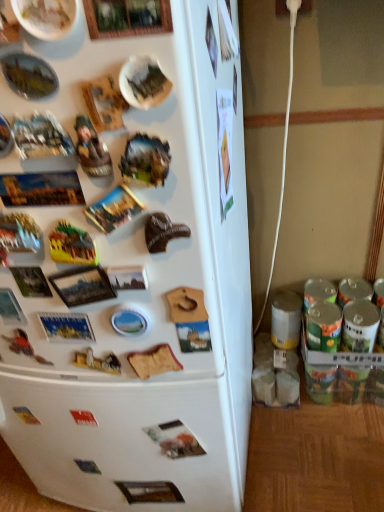
Question: Is white matte refrigerator at left not within wooden figurine at upper left?

Choices:
 (A) no
 (B) yes

Answer: (B)

Question: Is white matte refrigerator at left behind wooden figurine at upper left?

Choices:
 (A) yes
 (B) no

Answer: (B)

Question: Is wooden figurine at upper left located within white matte refrigerator at left?

Choices:
 (A) yes
 (B) no

Answer: (A)

Question: Considering the relative positions of white matte refrigerator at left and wooden figurine at upper left in the image provided, is white matte refrigerator at left to the right of wooden figurine at upper left from the viewer's perspective?

Choices:
 (A) yes
 (B) no

Answer: (B)

Question: From a real-world perspective, is white matte refrigerator at left physically below wooden figurine at upper left?

Choices:
 (A) no
 (B) yes

Answer: (B)

Question: From the image's perspective, is white matte refrigerator at left beneath wooden figurine at upper left?

Choices:
 (A) no
 (B) yes

Answer: (B)

Question: Can you confirm if wooden figurine at upper left is taller than white matte refrigerator at left?

Choices:
 (A) no
 (B) yes

Answer: (A)

Question: Does wooden figurine at upper left have a lesser width compared to white matte refrigerator at left?

Choices:
 (A) no
 (B) yes

Answer: (B)

Question: Does wooden figurine at upper left appear on the left side of white matte refrigerator at left?

Choices:
 (A) no
 (B) yes

Answer: (A)

Question: Considering the relative sizes of wooden figurine at upper left and white matte refrigerator at left in the image provided, is wooden figurine at upper left shorter than white matte refrigerator at left?

Choices:
 (A) yes
 (B) no

Answer: (A)

Question: Considering the relative sizes of wooden figurine at upper left and white matte refrigerator at left in the image provided, is wooden figurine at upper left bigger than white matte refrigerator at left?

Choices:
 (A) no
 (B) yes

Answer: (A)

Question: Is wooden figurine at upper left in contact with white matte refrigerator at left?

Choices:
 (A) no
 (B) yes

Answer: (A)

Question: From a real-world perspective, is wooden figurine at upper left positioned above or below white matte refrigerator at left?

Choices:
 (A) below
 (B) above

Answer: (B)